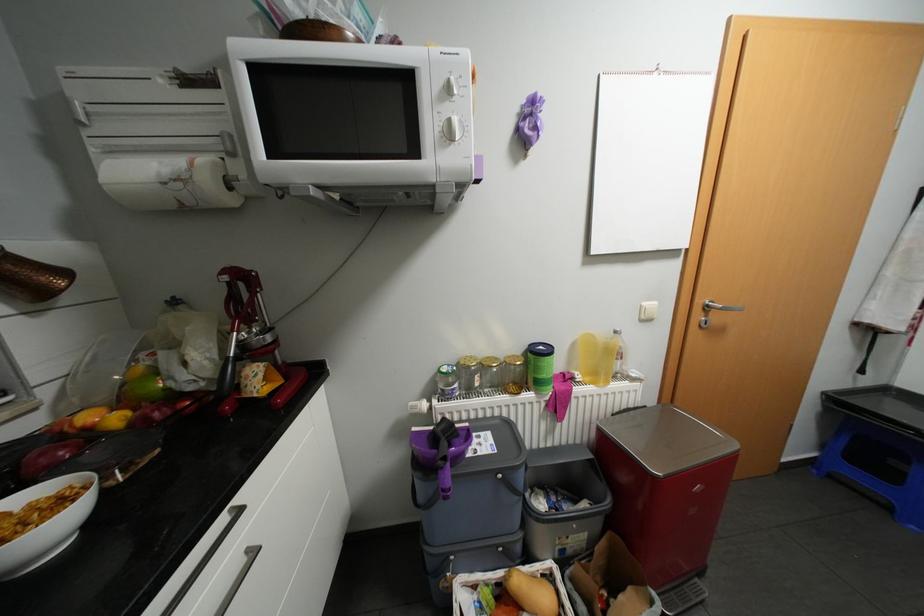
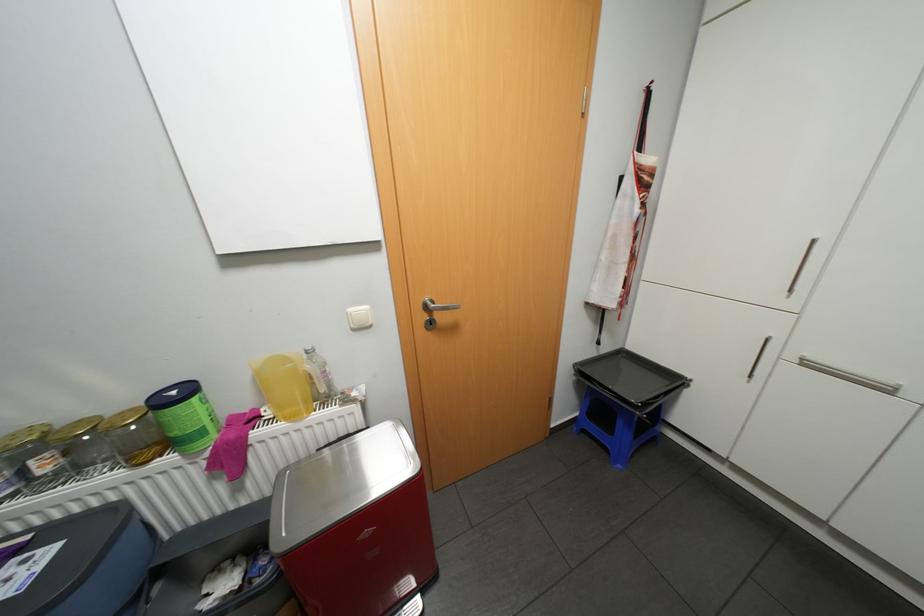
Locate, in the second image, the point that corresponds to [495,357] in the first image.

(88, 419)